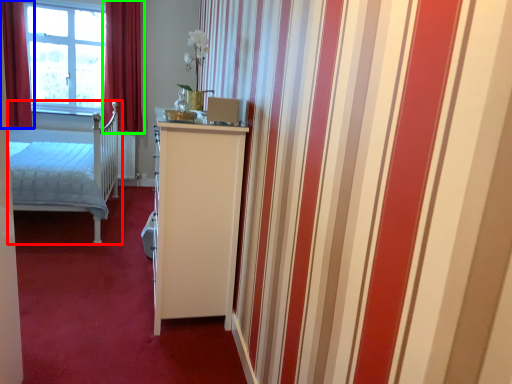
Question: Which is farther away from bed (highlighted by a red box)? curtain (highlighted by a blue box) or curtain (highlighted by a green box)?

Choices:
 (A) curtain
 (B) curtain

Answer: (B)